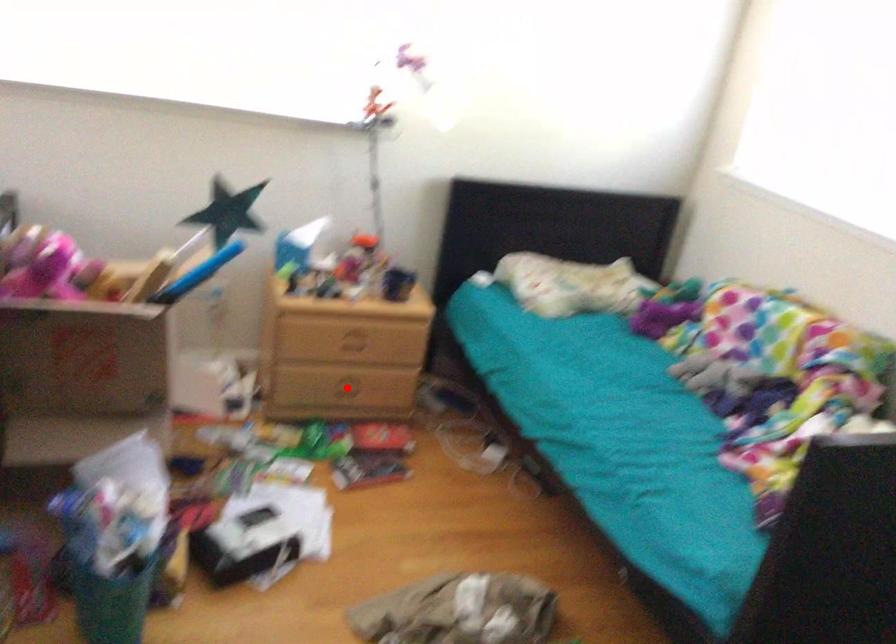
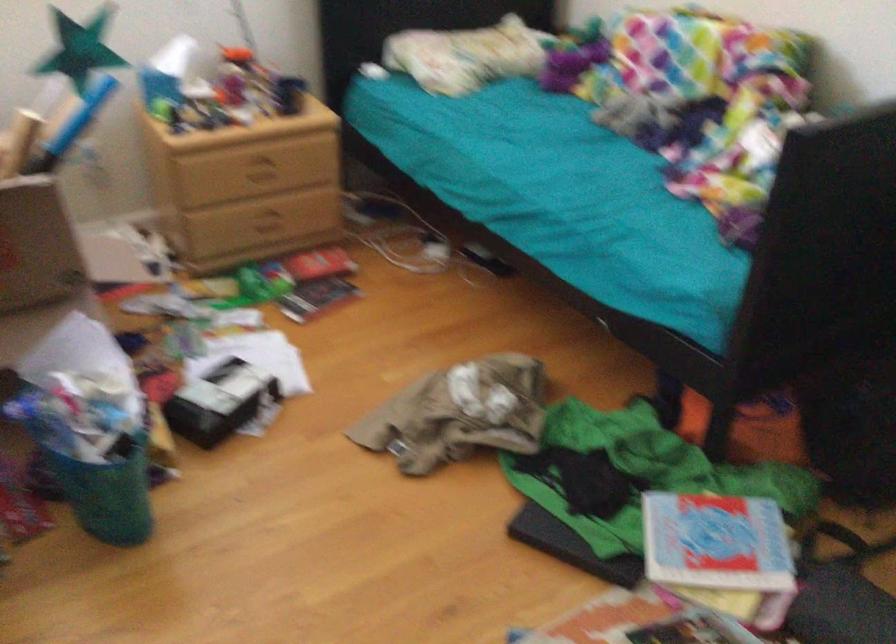
Locate, in the second image, the point that corresponds to the highlighted location in the first image.

(268, 222)